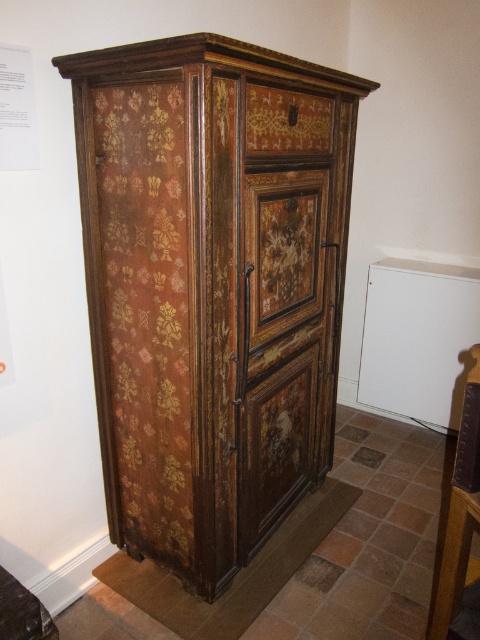
Is gold-patterned wood door at center thinner than rustic wood drawer at center?

In fact, gold-patterned wood door at center might be wider than rustic wood drawer at center.

Does gold-patterned wood door at center appear on the left side of rustic wood drawer at center?

Incorrect, gold-patterned wood door at center is not on the left side of rustic wood drawer at center.

The width and height of the screenshot is (480, 640). Describe the element at coordinates (284, 346) in the screenshot. I see `gold-patterned wood door at center` at that location.

This screenshot has width=480, height=640. What are the coordinates of `gold-patterned wood door at center` in the screenshot? It's located at (284, 346).

Between wooden floral-patterned cabinet at center and gold-patterned wood door at center, which one has more height?

wooden floral-patterned cabinet at center

Which is in front, point (149, 40) or point (290, 324)?

Positioned in front is point (149, 40).

Find the location of a particular element. Image resolution: width=480 pixels, height=640 pixels. wooden floral-patterned cabinet at center is located at coordinates (206, 292).

Can you confirm if wooden floral-patterned cabinet at center is positioned to the right of gold-patterned wood drawer at upper center?

In fact, wooden floral-patterned cabinet at center is to the left of gold-patterned wood drawer at upper center.

Does wooden floral-patterned cabinet at center have a larger size compared to gold-patterned wood drawer at upper center?

Yes.

Is point (143, 164) less distant than point (315, 113)?

Yes, it is.

What are the coordinates of `wooden floral-patterned cabinet at center` in the screenshot? It's located at [x=206, y=292].